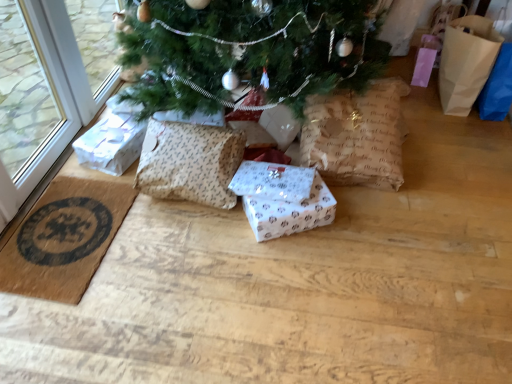
Question: Is white paper gift at center, arranged as the 2th gift box when viewed from the right, closer to the viewer compared to white paper gift box at center, which is the 1th gift box from right to left?

Choices:
 (A) no
 (B) yes

Answer: (A)

Question: From the image's perspective, is white paper gift at center, arranged as the 2th gift box when viewed from the right, above white paper gift box at center, which is the 1th gift box from right to left?

Choices:
 (A) yes
 (B) no

Answer: (A)

Question: From the image's perspective, is white paper gift at center, arranged as the 2th gift box when viewed from the right, beneath white paper gift box at center, which is the 1th gift box from right to left?

Choices:
 (A) yes
 (B) no

Answer: (B)

Question: Does white paper gift at center, arranged as the 2th gift box when viewed from the right, turn towards white paper gift box at center, the 3th gift box viewed from the left?

Choices:
 (A) no
 (B) yes

Answer: (A)

Question: Is white paper gift at center, arranged as the 2th gift box when viewed from the right, further to camera compared to white paper gift box at center, the 3th gift box viewed from the left?

Choices:
 (A) no
 (B) yes

Answer: (B)

Question: Does point (275, 226) appear closer or farther from the camera than point (386, 188)?

Choices:
 (A) closer
 (B) farther

Answer: (A)

Question: Is white paper gift box at center, which is the 1th gift box from right to left, inside the boundaries of brown paper bag at center, or outside?

Choices:
 (A) inside
 (B) outside

Answer: (B)

Question: In terms of height, does white paper gift box at center, which is the 1th gift box from right to left, look taller or shorter compared to brown paper bag at center?

Choices:
 (A) short
 (B) tall

Answer: (A)

Question: Visually, is white paper gift box at center, the 3th gift box viewed from the left, positioned to the left or to the right of brown paper bag at center?

Choices:
 (A) left
 (B) right

Answer: (A)

Question: In terms of size, does white paper gift at center, arranged as the 2th gift box when viewed from the right, appear bigger or smaller than brown woven mat at lower left?

Choices:
 (A) small
 (B) big

Answer: (A)

Question: Is white paper gift at center, which appears as the second gift box when viewed from the left, spatially inside brown woven mat at lower left, or outside of it?

Choices:
 (A) outside
 (B) inside

Answer: (A)

Question: In the image, is white paper gift at center, which appears as the second gift box when viewed from the left, positioned in front of or behind brown woven mat at lower left?

Choices:
 (A) front
 (B) behind

Answer: (B)

Question: From a real-world perspective, is white paper gift at center, which appears as the second gift box when viewed from the left, above or below brown woven mat at lower left?

Choices:
 (A) below
 (B) above

Answer: (B)

Question: Do you think white paper gift box at center, which is the 1th gift box from right to left, is within brown paper bag at right, or outside of it?

Choices:
 (A) inside
 (B) outside

Answer: (B)

Question: In the image, is white paper gift box at center, which is the 1th gift box from right to left, on the left side or the right side of brown paper bag at right?

Choices:
 (A) right
 (B) left

Answer: (B)